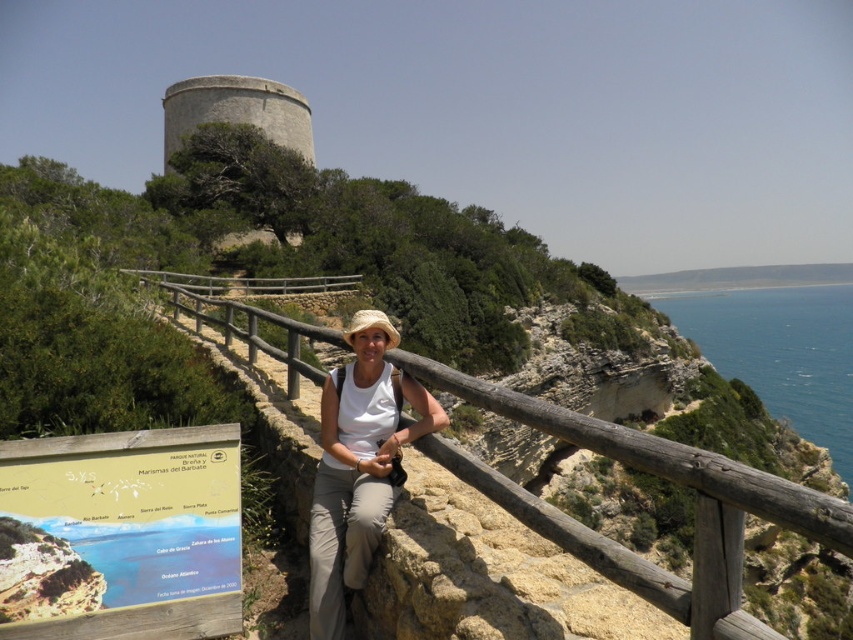
Question: Does wooden at center appear on the left side of white matte shirt at center?

Choices:
 (A) yes
 (B) no

Answer: (A)

Question: Which object is closer to the camera taking this photo?

Choices:
 (A) wooden at center
 (B) white matte shirt at center

Answer: (A)

Question: Which of the following is the closest to the observer?

Choices:
 (A) [x=514, y=410]
 (B) [x=315, y=634]

Answer: (A)

Question: Is wooden at center to the right of white matte shirt at center from the viewer's perspective?

Choices:
 (A) no
 (B) yes

Answer: (A)

Question: Is wooden at center wider than white matte shirt at center?

Choices:
 (A) yes
 (B) no

Answer: (A)